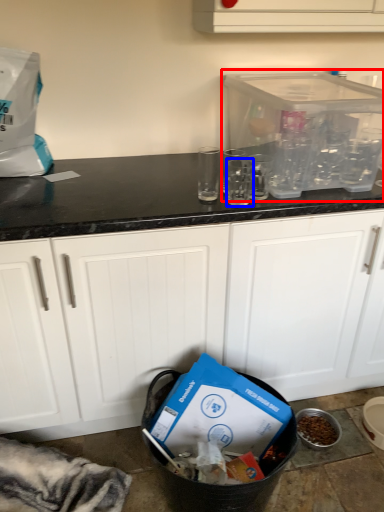
Question: Which object appears farthest to the camera in this image, appliance (highlighted by a red box) or clear (highlighted by a blue box)?

Choices:
 (A) appliance
 (B) clear

Answer: (B)